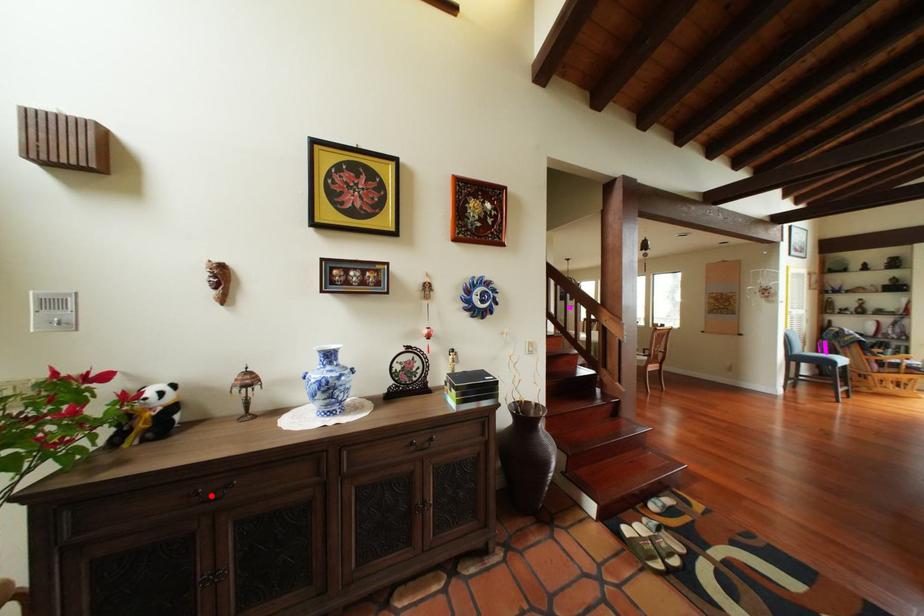
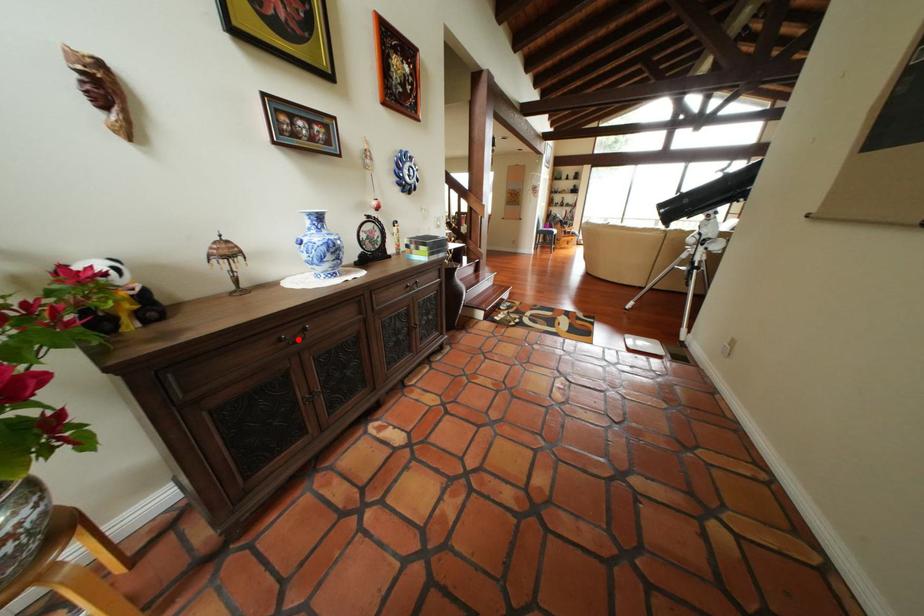
I am providing you with two images of the same scene from different viewpoints. A red point is marked on the first image and another point is marked on the second image. Is the marked point in image1 the same physical position as the marked point in image2?

Yes